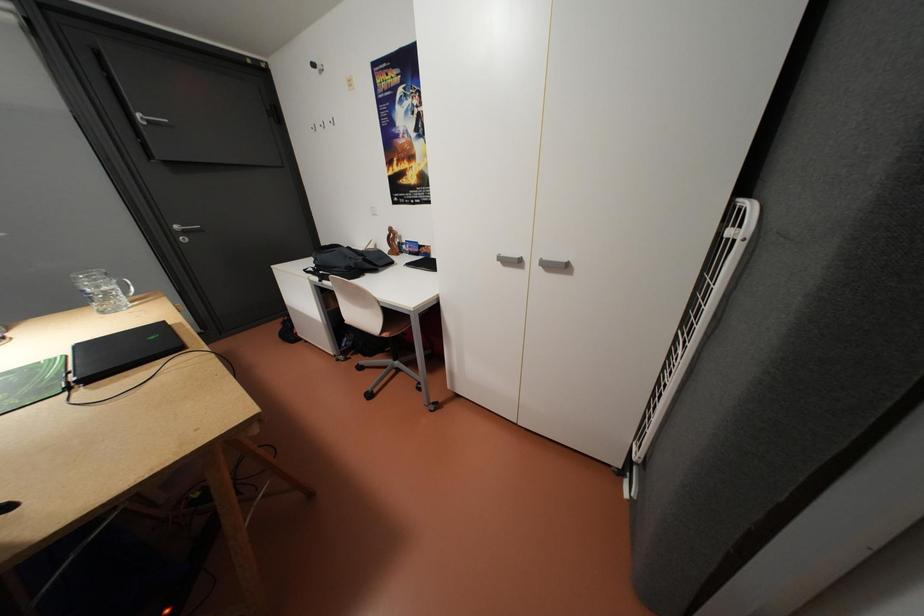
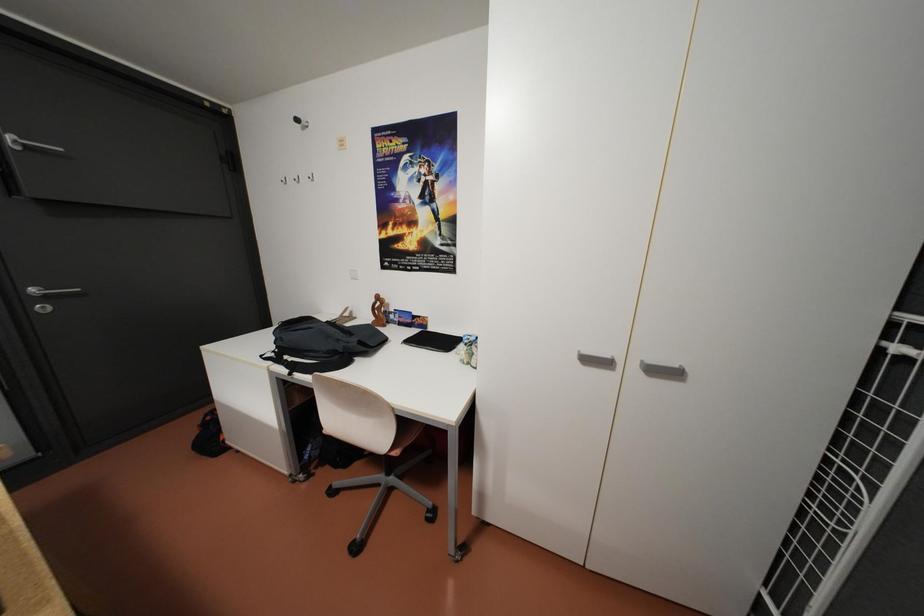
Question: The camera is either moving clockwise (left) or counter-clockwise (right) around the object. The first image is from the beginning of the video and the second image is from the end. Is the camera moving left or right when shooting the video?

Choices:
 (A) Left
 (B) Right

Answer: (A)